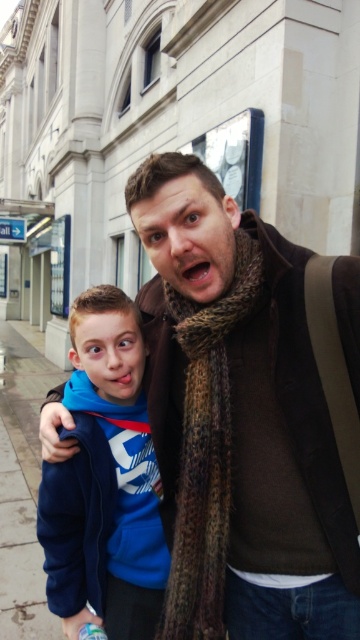
Question: Among these objects, which one is nearest to the camera?

Choices:
 (A) blue fleece jacket at left
 (B) brown knitted scarf at center

Answer: (B)

Question: Can you confirm if brown textured scarf at center is bigger than gray concrete pavement at lower left?

Choices:
 (A) yes
 (B) no

Answer: (B)

Question: Is brown knitted scarf at center above blue fleece jacket at left?

Choices:
 (A) no
 (B) yes

Answer: (B)

Question: Does brown textured scarf at center have a greater width compared to gray concrete pavement at lower left?

Choices:
 (A) yes
 (B) no

Answer: (B)

Question: Among these points, which one is farthest from the camera?

Choices:
 (A) (48, 604)
 (B) (30, 404)
 (C) (334, 595)
 (D) (204, 330)

Answer: (B)

Question: Which of these objects is positioned farthest from the gray concrete pavement at lower left?

Choices:
 (A) brown textured scarf at center
 (B) blue fleece jacket at left
 (C) brown knitted scarf at center

Answer: (B)